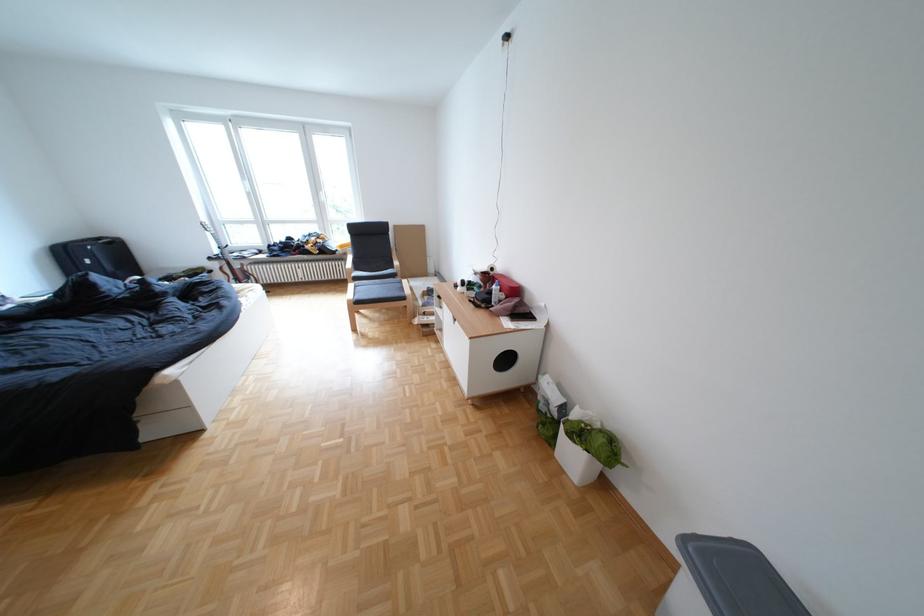
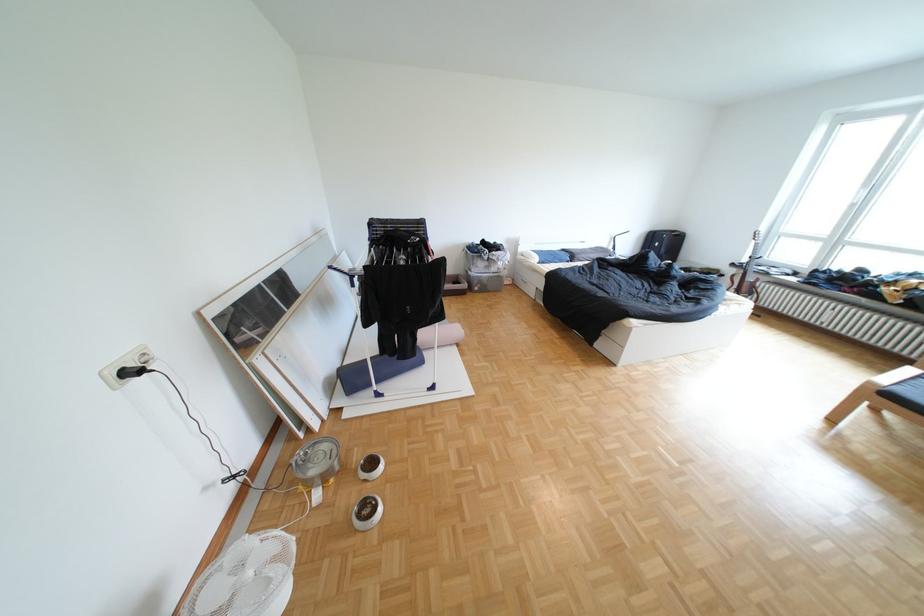
First-person continuous shooting, in which direction is the camera rotating?

The camera rotated toward left-down.